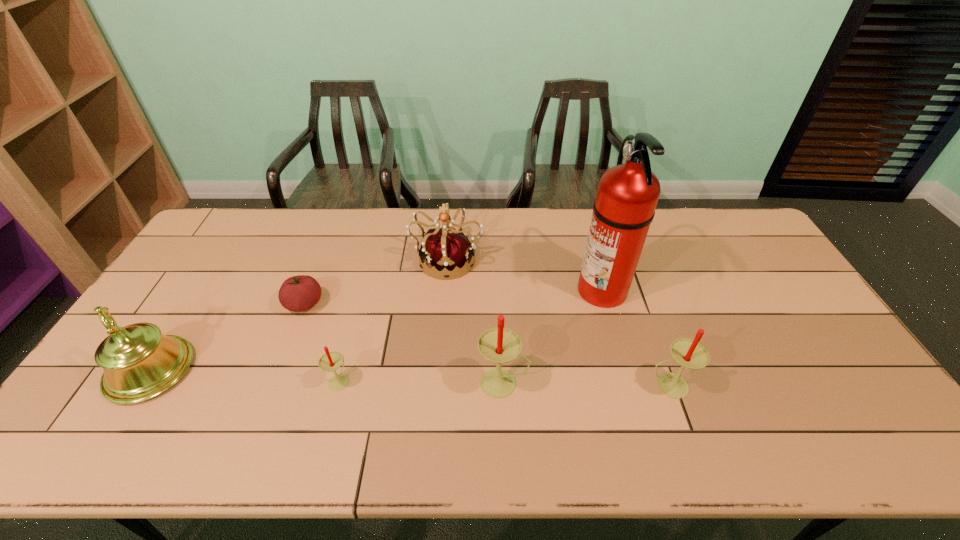
Observe the arrangement of all candles in the image. To keep them evenly spaced, where would you place another candle on the right? Please locate a free space. Please provide its 2D coordinates. Your answer should be formatted as a tuple, i.e. [(x, y)], where the tuple contains the x and y coordinates of a point satisfying the conditions above.

[(835, 388)]